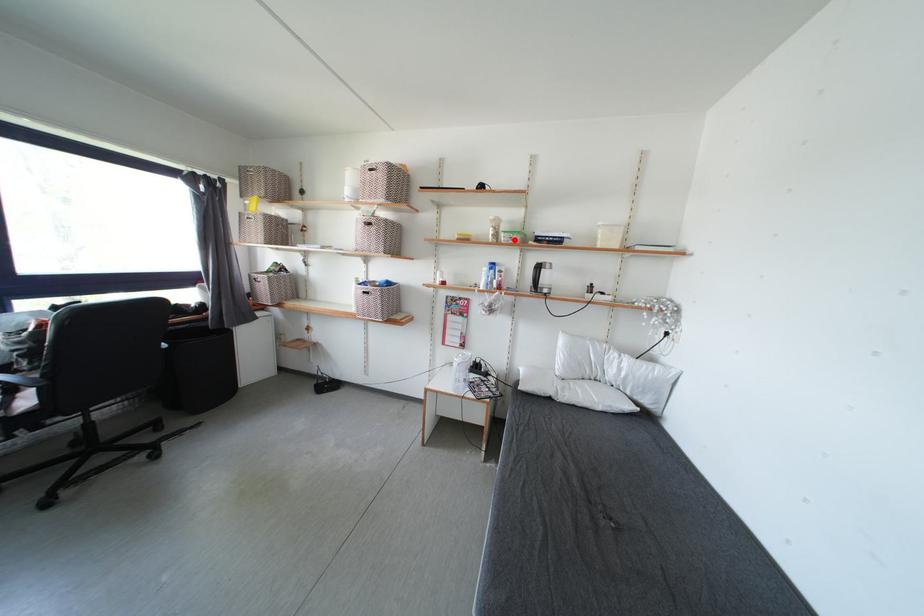
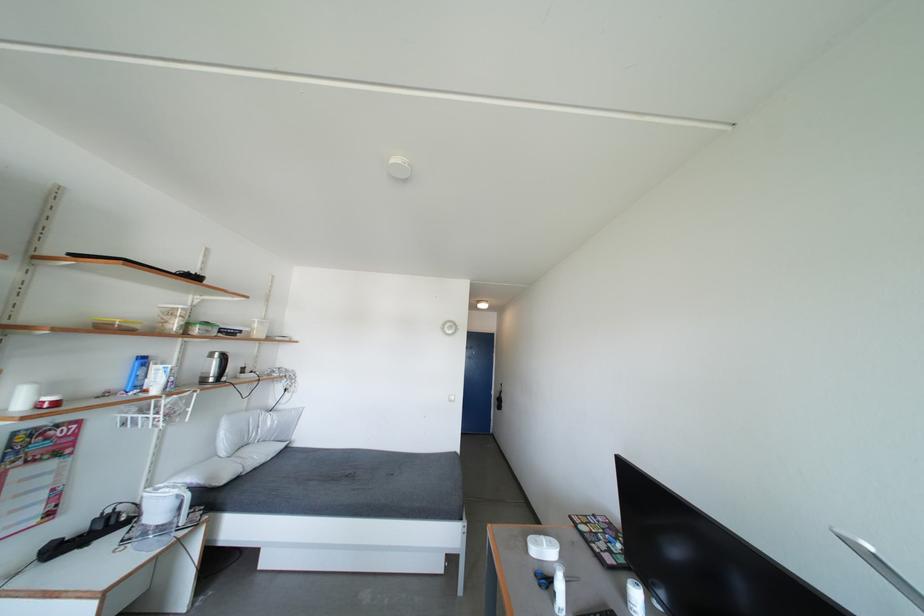
Question: I am providing you with two images of the same scene from different viewpoints. A red point is shown in image1. For the corresponding object point in image2, is it positioned nearer or farther from the camera?

Choices:
 (A) Nearer
 (B) Farther

Answer: (B)